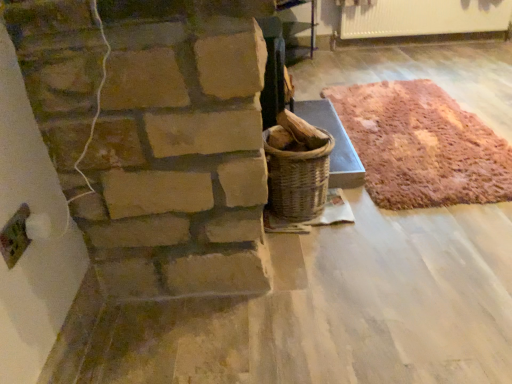
What are the coordinates of `rustic woolen rug at right` in the screenshot? It's located at (422, 146).

The width and height of the screenshot is (512, 384). What do you see at coordinates (422, 146) in the screenshot?
I see `rustic woolen rug at right` at bounding box center [422, 146].

The height and width of the screenshot is (384, 512). I want to click on white glossy radiator at upper right, so click(x=422, y=17).

This screenshot has height=384, width=512. Describe the element at coordinates (422, 17) in the screenshot. I see `white glossy radiator at upper right` at that location.

At what (x,y) coordinates should I click in order to perform the action: click on rustic woolen rug at right. Please return your answer as a coordinate pair (x, y). Image resolution: width=512 pixels, height=384 pixels. Looking at the image, I should click on (422, 146).

Is rustic woolen rug at right to the right of white glossy radiator at upper right from the viewer's perspective?

No.

Does rustic woolen rug at right come in front of white glossy radiator at upper right?

Yes, rustic woolen rug at right is in front of white glossy radiator at upper right.

Does point (403, 105) come behind point (344, 12)?

No, (403, 105) is closer to viewer.

From the image's perspective, which is above, rustic woolen rug at right or white glossy radiator at upper right?

white glossy radiator at upper right, from the image's perspective.

From a real-world perspective, which is physically below, rustic woolen rug at right or white glossy radiator at upper right?

rustic woolen rug at right, from a real-world perspective.

Considering the sizes of rustic woolen rug at right and white glossy radiator at upper right in the image, is rustic woolen rug at right wider or thinner than white glossy radiator at upper right?

Clearly, rustic woolen rug at right has more width compared to white glossy radiator at upper right.

Between rustic woolen rug at right and white glossy radiator at upper right, which one has more height?

Standing taller between the two is white glossy radiator at upper right.

Between rustic woolen rug at right and white glossy radiator at upper right, which one has larger size?

Bigger between the two is rustic woolen rug at right.

Choose the correct answer: Is rustic woolen rug at right inside white glossy radiator at upper right or outside it?

rustic woolen rug at right is located beyond the bounds of white glossy radiator at upper right.

Is rustic woolen rug at right not near white glossy radiator at upper right?

Yes, rustic woolen rug at right and white glossy radiator at upper right are located far from each other.

Could you tell me if rustic woolen rug at right is turned towards white glossy radiator at upper right?

No, rustic woolen rug at right is not facing towards white glossy radiator at upper right.

How different are the orientations of rustic woolen rug at right and white glossy radiator at upper right in degrees?

The facing directions of rustic woolen rug at right and white glossy radiator at upper right are 89.9 degrees apart.

How much distance is there between rustic woolen rug at right and white glossy radiator at upper right?

They are 6.13 feet apart.

This screenshot has width=512, height=384. Identify the location of mat on the left of white glossy radiator at upper right. (422, 146).

Is white glossy radiator at upper right at the right side of rustic woolen rug at right?

Yes, white glossy radiator at upper right is to the right of rustic woolen rug at right.

In the image, is white glossy radiator at upper right positioned in front of or behind rustic woolen rug at right?

Visually, white glossy radiator at upper right is located behind rustic woolen rug at right.

Which is nearer, (354, 13) or (402, 131)?

Point (354, 13) appears to be farther away from the viewer than point (402, 131).

From the image's perspective, between white glossy radiator at upper right and rustic woolen rug at right, which one is located above?

white glossy radiator at upper right appears higher in the image.

From a real-world perspective, is white glossy radiator at upper right on top of rustic woolen rug at right?

Indeed, from a real-world perspective, white glossy radiator at upper right stands above rustic woolen rug at right.

Is white glossy radiator at upper right wider than rustic woolen rug at right?

No.

Does white glossy radiator at upper right have a greater height compared to rustic woolen rug at right?

Yes, white glossy radiator at upper right is taller than rustic woolen rug at right.

Who is smaller, white glossy radiator at upper right or rustic woolen rug at right?

With smaller size is white glossy radiator at upper right.

Is white glossy radiator at upper right surrounding rustic woolen rug at right?

That's incorrect, rustic woolen rug at right is not inside white glossy radiator at upper right.

Is white glossy radiator at upper right not close to rustic woolen rug at right?

That's right, there is a large distance between white glossy radiator at upper right and rustic woolen rug at right.

Is white glossy radiator at upper right positioned with its back to rustic woolen rug at right?

No, white glossy radiator at upper right is not facing away from rustic woolen rug at right.

What are the coordinates of `radiator to the right of rustic woolen rug at right` in the screenshot? It's located at (422, 17).

Where is `mat in front of the white glossy radiator at upper right`? Image resolution: width=512 pixels, height=384 pixels. mat in front of the white glossy radiator at upper right is located at coordinates (422, 146).

Where is `mat on the left of white glossy radiator at upper right`? The height and width of the screenshot is (384, 512). mat on the left of white glossy radiator at upper right is located at coordinates (422, 146).